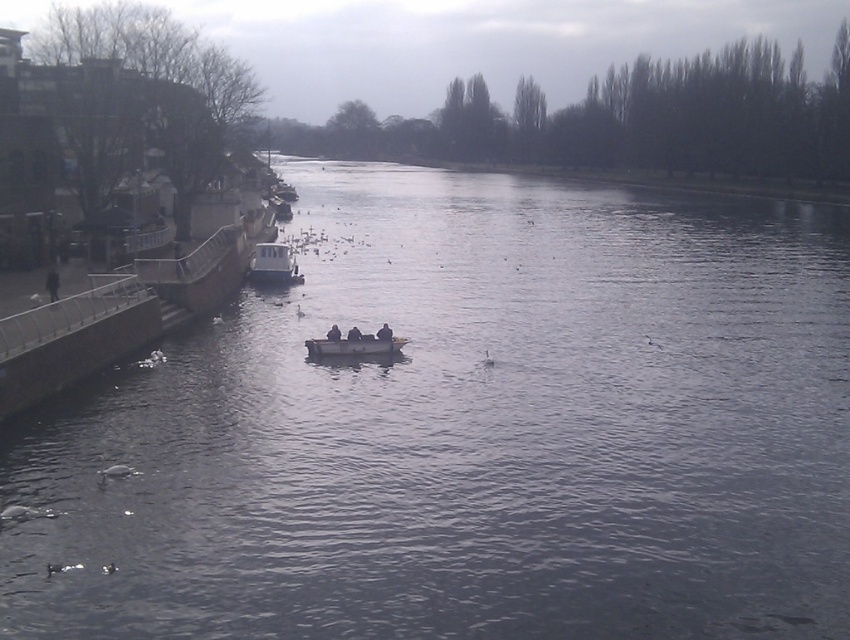
Is white plastic boat at center bigger than black matte boat at center?

Yes, white plastic boat at center is bigger than black matte boat at center.

Does white plastic boat at center have a greater width compared to black matte boat at center?

Correct, the width of white plastic boat at center exceeds that of black matte boat at center.

Where is `white plastic boat at center`? white plastic boat at center is located at coordinates (273, 264).

Who is lower down, gray matte duck at lower left or white fluffy duck at lower left?

white fluffy duck at lower left is lower down.

Is point (108, 474) in front of point (63, 570)?

No, it is behind (63, 570).

At what (x,y) coordinates should I click in order to perform the action: click on gray matte duck at lower left. Please return your answer as a coordinate pair (x, y). This screenshot has width=850, height=640. Looking at the image, I should click on (116, 472).

Can you confirm if white plastic boat at center is thinner than white matte duck at lower left?

No, white plastic boat at center is not thinner than white matte duck at lower left.

Is white plastic boat at center to the right of white matte duck at lower left from the viewer's perspective?

No, white plastic boat at center is not to the right of white matte duck at lower left.

In order to click on white plastic boat at center in this screenshot , I will do `click(273, 264)`.

Identify the location of white plastic boat at center. The image size is (850, 640). (273, 264).